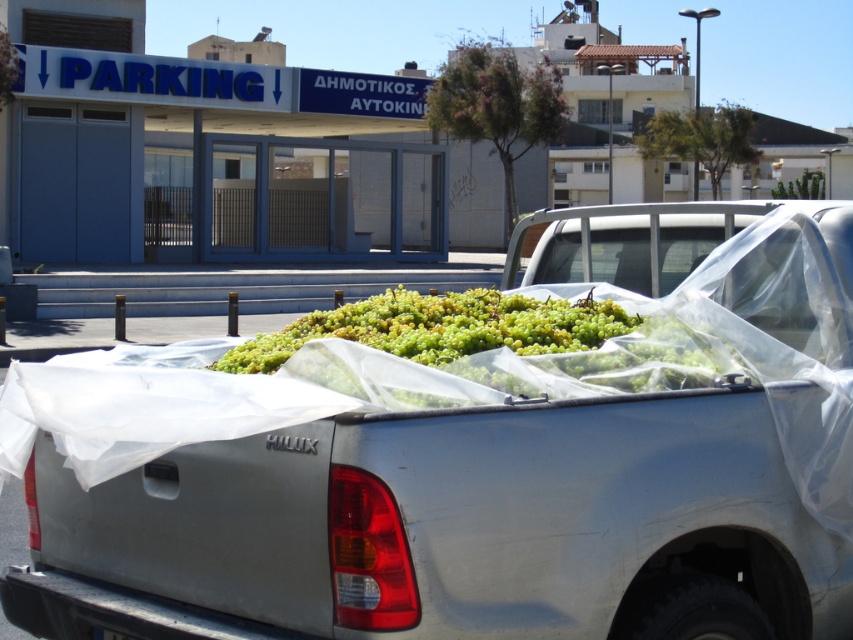
Does white matte truck at center have a greater width compared to green matte grapes at center?

Yes.

Where is `white matte truck at center`? This screenshot has width=853, height=640. white matte truck at center is located at coordinates (465, 472).

What do you see at coordinates (465, 472) in the screenshot?
I see `white matte truck at center` at bounding box center [465, 472].

Where is `white matte truck at center`? This screenshot has height=640, width=853. white matte truck at center is located at coordinates (465, 472).